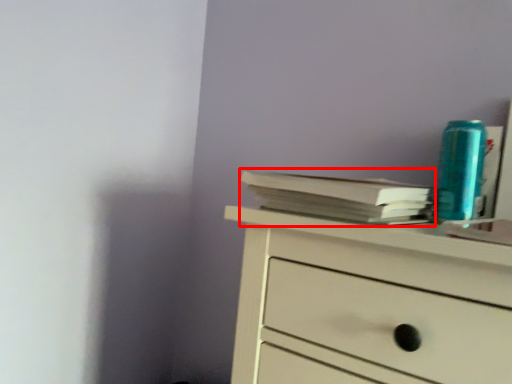
Question: Observing the image, what is the correct spatial positioning of paperback book (annotated by the red box) in reference to teal?

Choices:
 (A) right
 (B) left

Answer: (B)